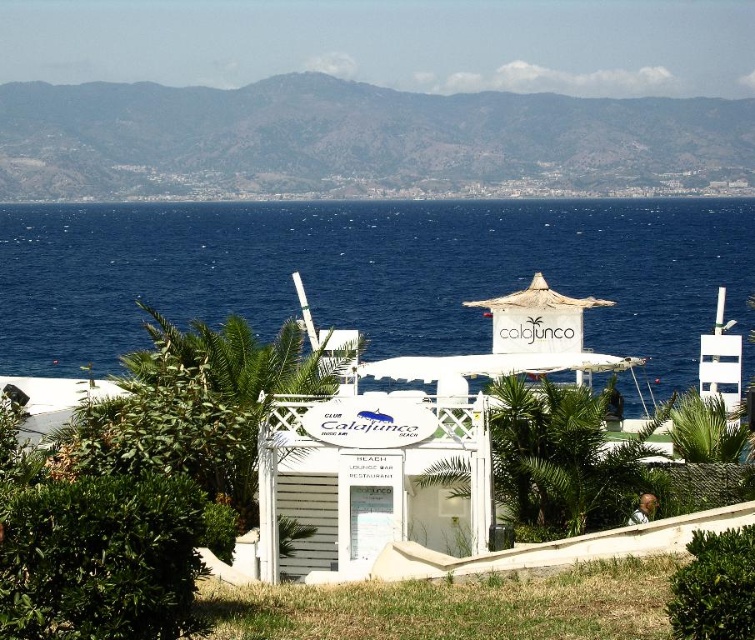
Is point (134, 280) positioned after point (538, 189)?

No, (134, 280) is closer to viewer.

Does blue water at center have a greater height compared to green grassy hillside at upper center?

No, blue water at center is not taller than green grassy hillside at upper center.

What are the coordinates of `blue water at center` in the screenshot? It's located at (370, 273).

You are a GUI agent. You are given a task and a screenshot of the screen. Output one action in this format:
    pyautogui.click(x=<x>, y=<y>)
    Task: Click on the blue water at center
    
    Given the screenshot: What is the action you would take?
    pyautogui.click(x=370, y=273)